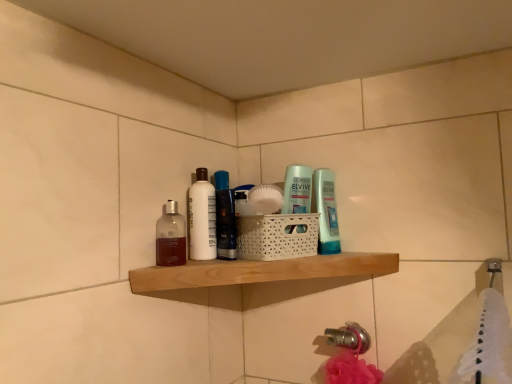
Question: Is white matte bottle at center, arranged as the first toiletry when viewed from the left, oriented away from natural wood shelf at center?

Choices:
 (A) yes
 (B) no

Answer: (B)

Question: Does white matte bottle at center, arranged as the first toiletry when viewed from the left, have a larger size compared to natural wood shelf at center?

Choices:
 (A) no
 (B) yes

Answer: (A)

Question: From a real-world perspective, is white matte bottle at center, arranged as the first toiletry when viewed from the left, positioned over natural wood shelf at center based on gravity?

Choices:
 (A) no
 (B) yes

Answer: (B)

Question: Could you tell me if white matte bottle at center, arranged as the first toiletry when viewed from the left, is facing natural wood shelf at center?

Choices:
 (A) yes
 (B) no

Answer: (B)

Question: Is natural wood shelf at center completely or partially inside white matte bottle at center, arranged as the first toiletry when viewed from the left?

Choices:
 (A) yes
 (B) no

Answer: (B)

Question: Can you confirm if white matte bottle at center, which is the second toiletry from right to left, is shorter than natural wood shelf at center?

Choices:
 (A) yes
 (B) no

Answer: (B)

Question: From a real-world perspective, is natural wood shelf at center below translucent plastic bottle at center, placed as the 1th toiletry when sorted from right to left?

Choices:
 (A) yes
 (B) no

Answer: (A)

Question: Is natural wood shelf at center at the left side of translucent plastic bottle at center, placed as the 1th toiletry when sorted from right to left?

Choices:
 (A) yes
 (B) no

Answer: (A)

Question: From the image's perspective, is natural wood shelf at center over translucent plastic bottle at center, placed as the 1th toiletry when sorted from right to left?

Choices:
 (A) yes
 (B) no

Answer: (B)

Question: Would you say natural wood shelf at center contains translucent plastic bottle at center, placed as the 1th toiletry when sorted from right to left?

Choices:
 (A) yes
 (B) no

Answer: (B)

Question: Is natural wood shelf at center behind translucent plastic bottle at center, marked as the 2th toiletry in a left-to-right arrangement?

Choices:
 (A) yes
 (B) no

Answer: (B)

Question: Is the position of natural wood shelf at center less distant than that of translucent plastic bottle at center, marked as the 2th toiletry in a left-to-right arrangement?

Choices:
 (A) no
 (B) yes

Answer: (B)

Question: Is the depth of white matte bottle at center, which is the second toiletry from right to left, greater than that of translucent plastic bottle at center, marked as the 2th toiletry in a left-to-right arrangement?

Choices:
 (A) no
 (B) yes

Answer: (B)